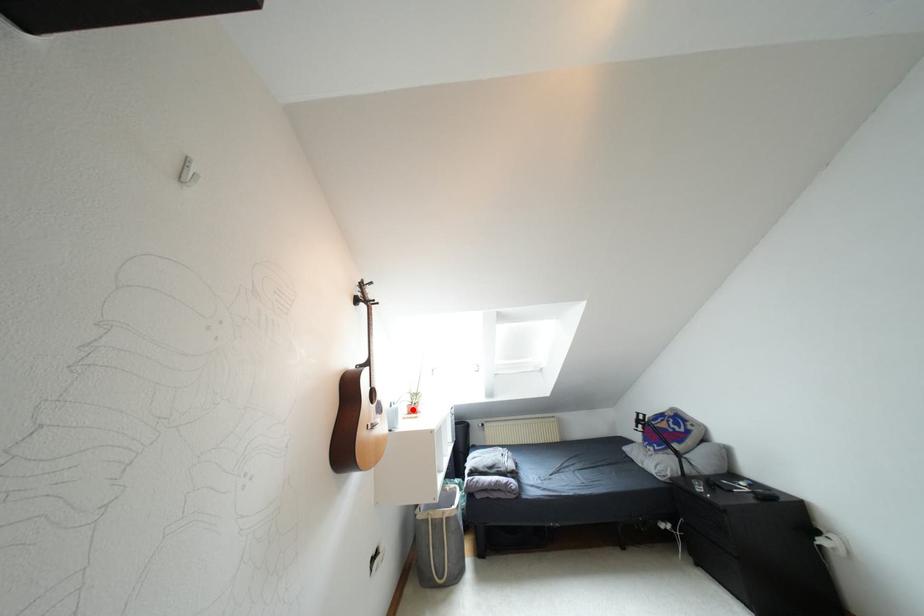
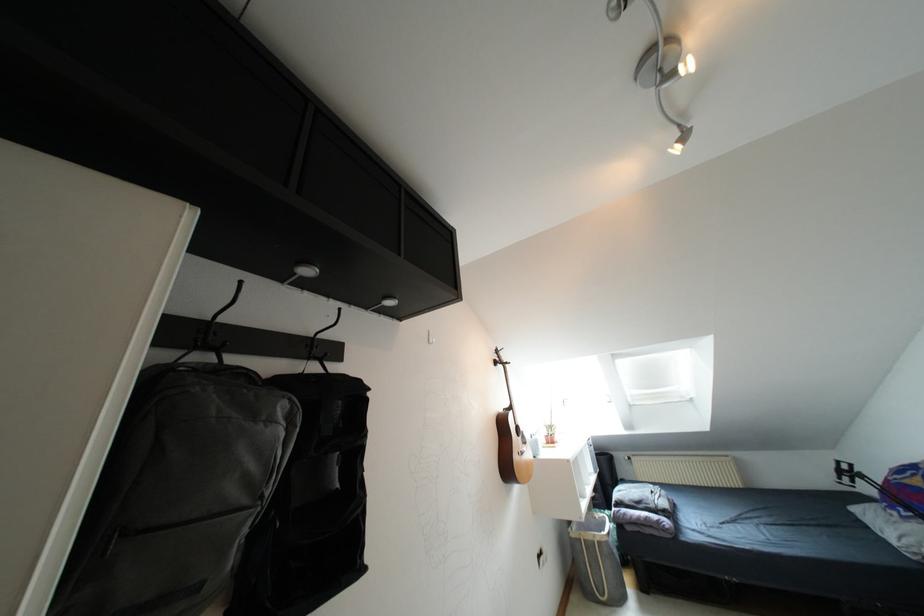
Where in the second image is the point corresponding to the highlighted location from the first image?

(550, 440)